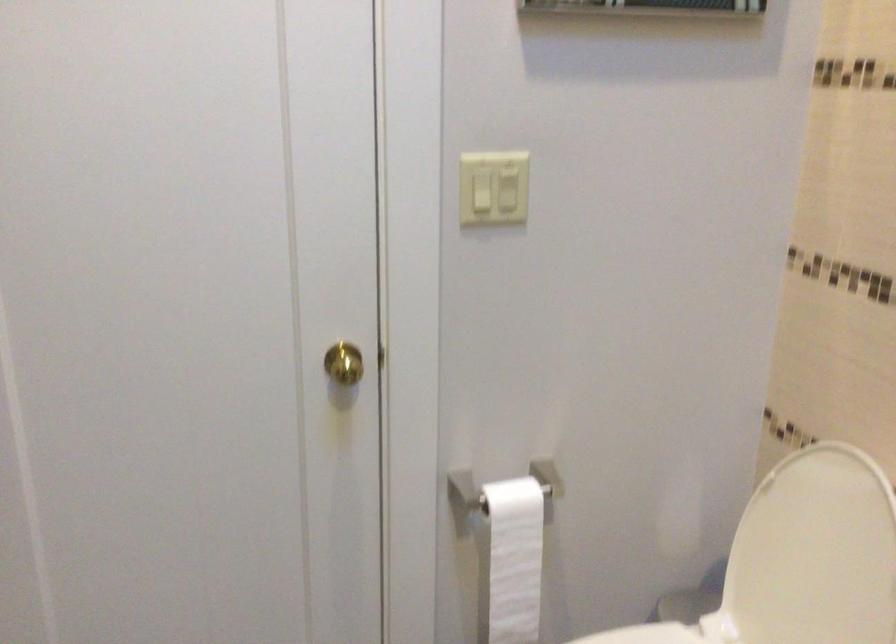
Find where to turn the gold door knob. Please return your answer as a coordinate pair (x, y).

(343, 363)